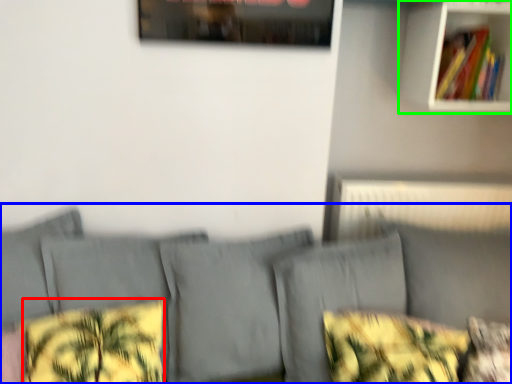
Question: Considering the real-world distances, which object is closest to pillow (highlighted by a red box)? couch (highlighted by a blue box) or shelf (highlighted by a green box).

Choices:
 (A) couch
 (B) shelf

Answer: (A)